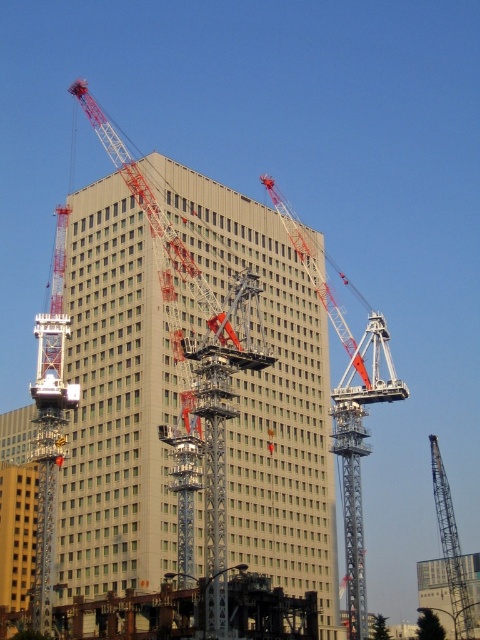
In the scene shown: You are a construction worker standing at the edge of the construction site. You need to determine which object is taller between the gray concrete building at center and the metallic gray crane at center. Based on the scene, which one is taller?

The gray concrete building at center is much taller than the metallic gray crane at center, so the gray concrete building at center is taller.

Looking at this image, you are a construction worker planning to move a heavy equipment from the left side of the construction site to the right side. You need to pass between the metallic red crane at center and the metallic gray crane at center. Which crane should you go around to ensure there is enough space for your equipment?

You should go around the metallic gray crane at center because it is smaller than the metallic red crane at center, providing more space to maneuver the heavy equipment safely.